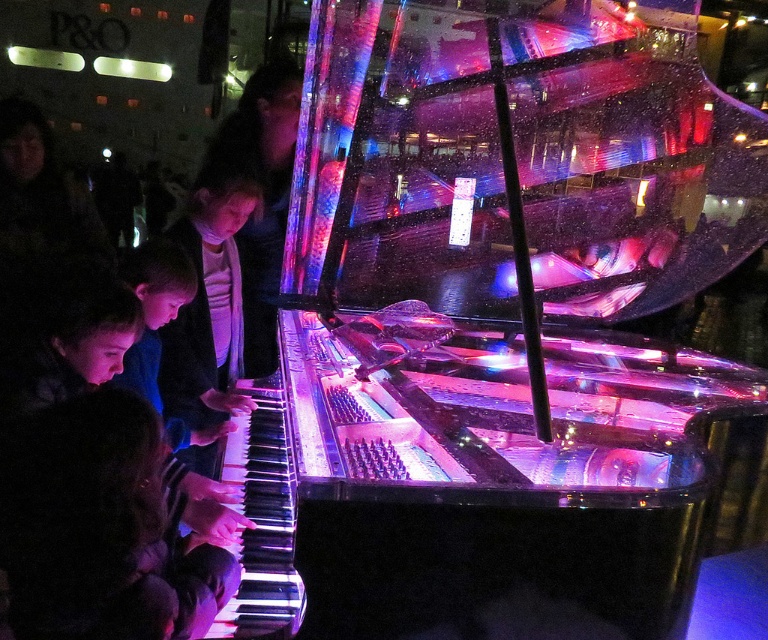
Question: Estimate the real-world distances between objects in this image. Which object is farther from the matte black piano keys at left?

Choices:
 (A) dark hair at lower left
 (B) transparent glass piano at left

Answer: (B)

Question: Is the position of dark hair at lower left less distant than that of matte black piano keys at left?

Choices:
 (A) no
 (B) yes

Answer: (B)

Question: Does dark hair at lower left have a smaller size compared to matte black piano keys at left?

Choices:
 (A) yes
 (B) no

Answer: (A)

Question: Estimate the real-world distances between objects in this image. Which object is closer to the transparent glass piano at left?

Choices:
 (A) dark hair at lower left
 (B) matte black piano keys at left

Answer: (A)

Question: Which of the following is the farthest from the observer?

Choices:
 (A) matte black piano keys at left
 (B) dark hair at lower left

Answer: (A)

Question: Does transparent glass piano at left lie behind matte black piano keys at left?

Choices:
 (A) no
 (B) yes

Answer: (A)